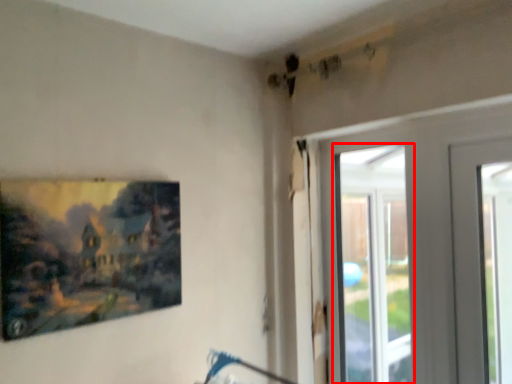
Question: From the image's perspective, considering the relative positions of window (annotated by the red box) and picture frame in the image provided, where is window (annotated by the red box) located with respect to the staircase?

Choices:
 (A) above
 (B) below

Answer: (B)